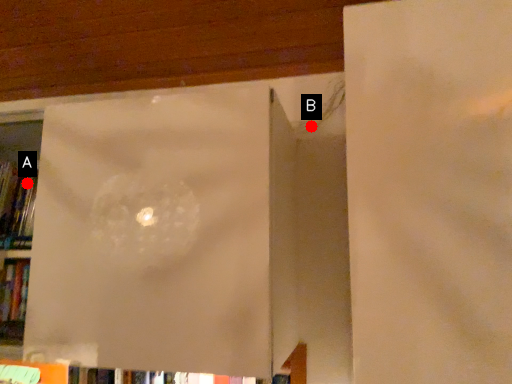
Question: Two points are circled on the image, labeled by A and B beside each circle. Among these points, which one is nearest to the camera?

Choices:
 (A) A is closer
 (B) B is closer

Answer: (B)